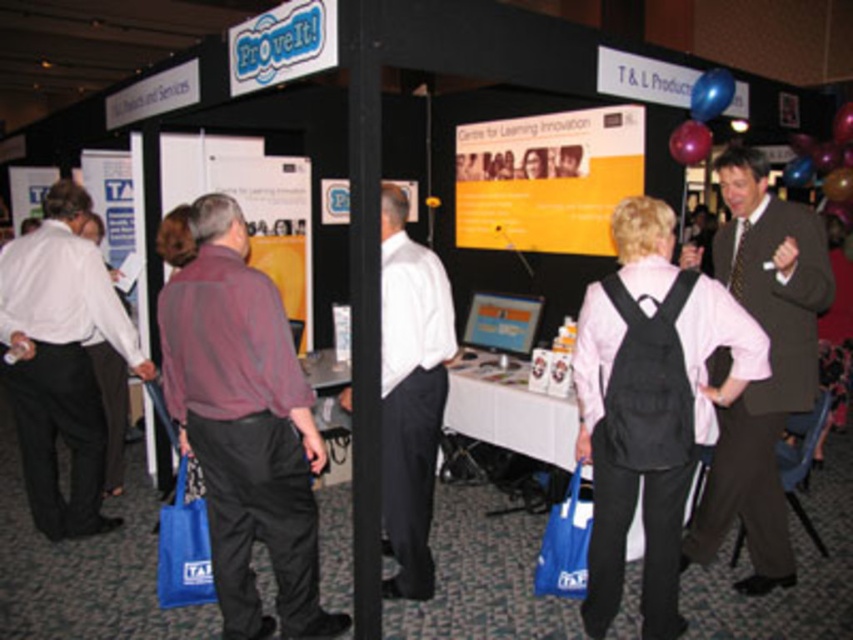
Question: Can you confirm if dark brown suit at right is positioned above white shirt at center?

Choices:
 (A) yes
 (B) no

Answer: (A)

Question: Is maroon fabric shirt at center smaller than white shirt at center?

Choices:
 (A) no
 (B) yes

Answer: (A)

Question: Which point is closer to the camera?

Choices:
 (A) dark brown suit at right
 (B) white shirt at left
 (C) maroon fabric shirt at center
 (D) white shirt at center

Answer: (C)

Question: Is dark brown suit at right bigger than white shirt at center?

Choices:
 (A) yes
 (B) no

Answer: (A)

Question: Which point appears farthest from the camera in this image?

Choices:
 (A) (757, 497)
 (B) (215, 257)
 (C) (15, 300)
 (D) (403, 316)

Answer: (C)

Question: Among these points, which one is farthest from the camera?

Choices:
 (A) (281, 369)
 (B) (65, 189)

Answer: (B)